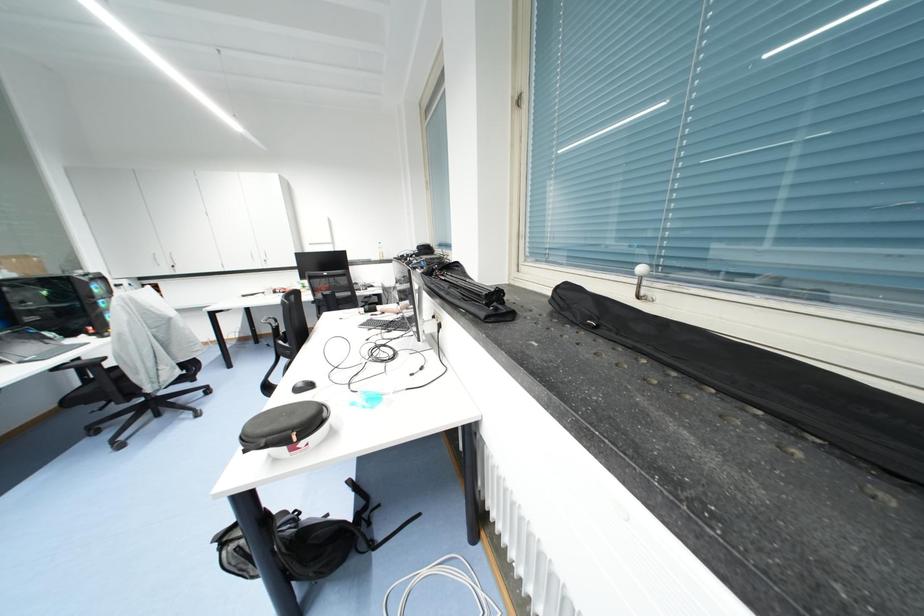
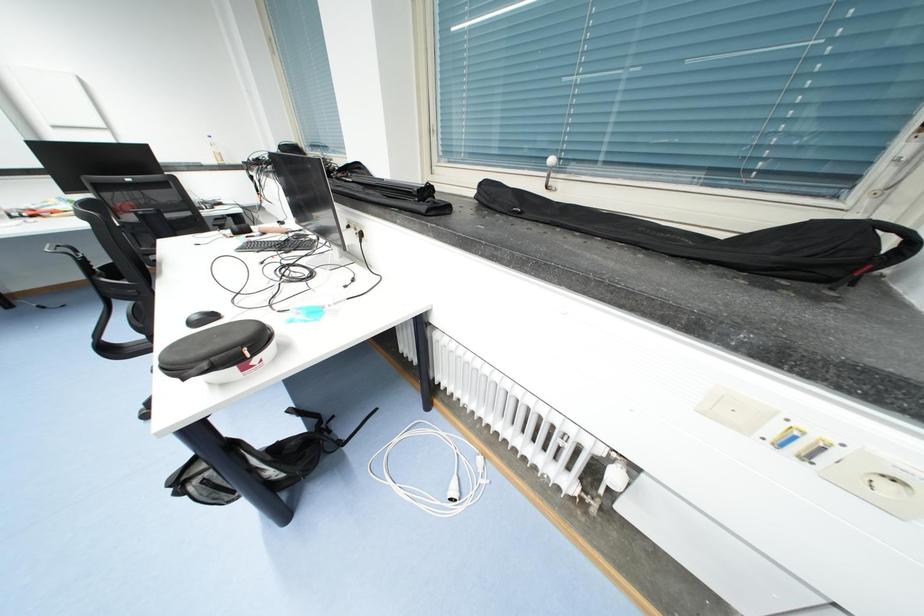
Based on the continuous images, in which direction is the camera rotating?

The camera's rotation is toward right-down.